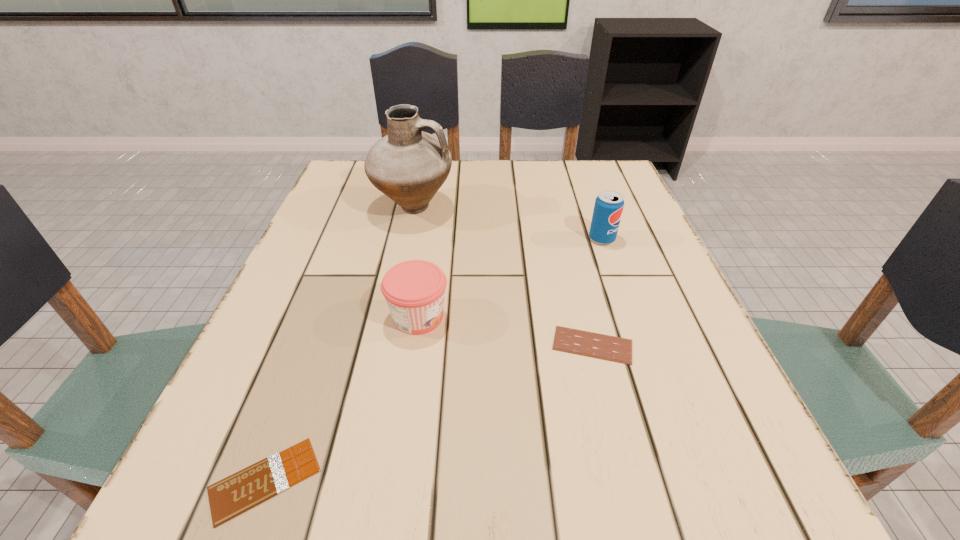
At what (x,y) coordinates should I click in order to perform the action: click on vacant space positioned on the front of the taller chocolate bar. Please return your answer as a coordinate pair (x, y). Looking at the image, I should click on (613, 428).

The width and height of the screenshot is (960, 540). In order to click on free space located on the back of the nearest object in this screenshot , I will do `click(299, 389)`.

I want to click on object at the far edge, so click(x=409, y=166).

Locate an element on the screen. object that is at the near edge is located at coordinates (253, 485).

Locate an element on the screen. The height and width of the screenshot is (540, 960). pitcher present at the left edge is located at coordinates (409, 166).

Identify the location of chocolate bar that is at the left edge. The image size is (960, 540). (253, 485).

Find the location of a particular element. This screenshot has height=540, width=960. soda can present at the right edge is located at coordinates (608, 208).

The width and height of the screenshot is (960, 540). Find the location of `chocolate bar present at the right edge`. chocolate bar present at the right edge is located at coordinates (590, 344).

You are a GUI agent. You are given a task and a screenshot of the screen. Output one action in this format:
    pyautogui.click(x=<x>, y=<y>)
    Task: Click on the object situated at the far left corner
    The height and width of the screenshot is (540, 960).
    Given the screenshot: What is the action you would take?
    pyautogui.click(x=409, y=166)

Find the location of `object that is at the near left corner`. object that is at the near left corner is located at coordinates (253, 485).